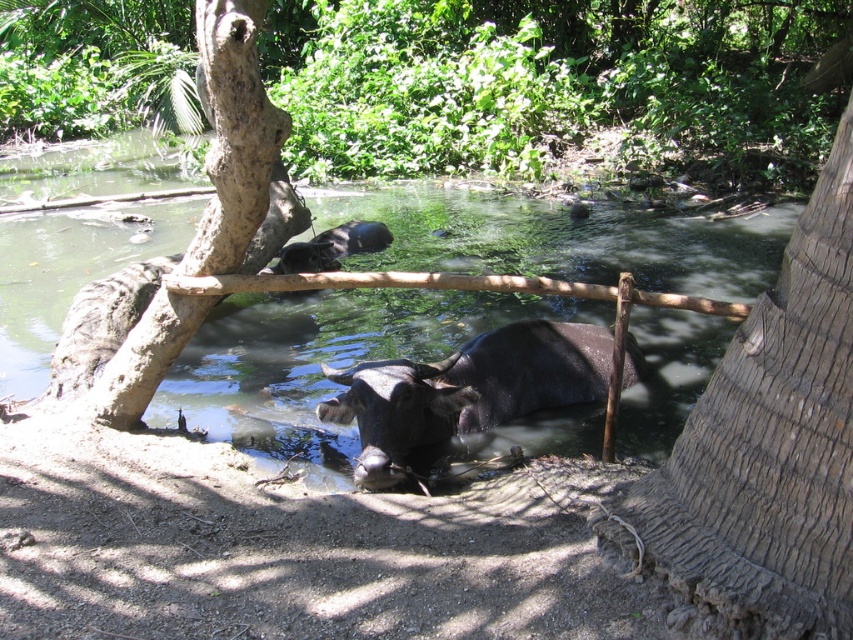
You are standing at the wooden fence and want to locate two points in the scene. The first point is at coordinate point (x=511, y=442) and the second is at point (x=384, y=474). Which point is farther away from you?

Point (x=511, y=442) is behind point (x=384, y=474), so the first point is farther away from you.

You are a photographer trying to capture the shiny dark brown bull at center in the clear water at center. Can you see the bull clearly through the water?

The clear water at center is positioned over shiny dark brown bull at center, so yes, you can see the bull clearly through the water.